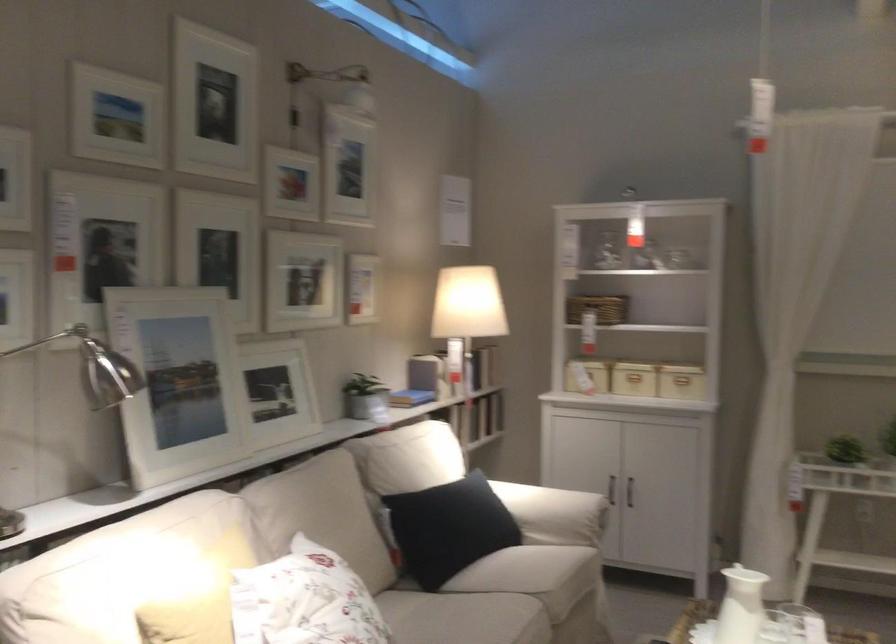
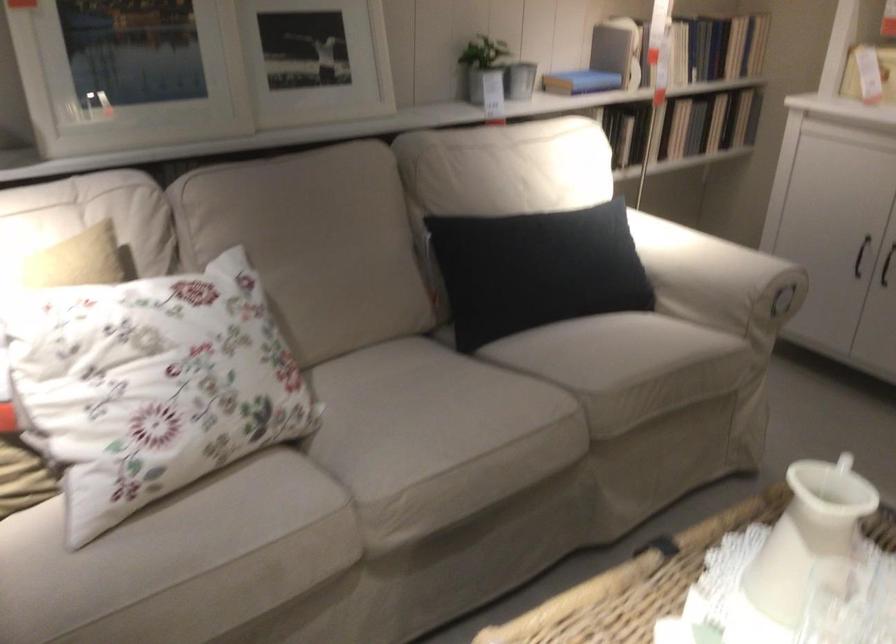
Where in the second image is the point corresponding to (x=416, y=400) from the first image?

(580, 82)